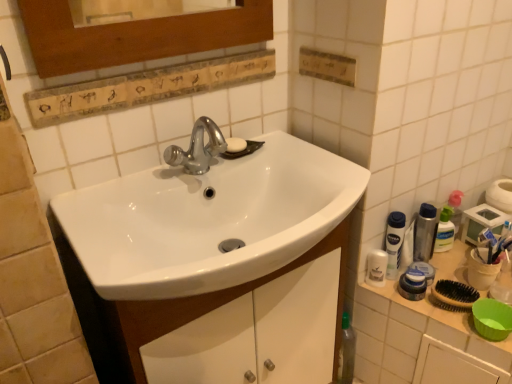
Identify the location of translucent plastic mouthwash at right, acting as the first mouthwash starting from the right. This screenshot has width=512, height=384. (452, 209).

Where is `white glossy sink at center`? This screenshot has height=384, width=512. white glossy sink at center is located at coordinates (165, 309).

What is the approximate width of white matte toothpaste at right?

It is 4.57 centimeters.

The image size is (512, 384). What are the coordinates of `white glossy sink at center` in the screenshot? It's located at pos(208,220).

Measure the distance between white plastic mouthwash at right, the first mouthwash when ordered from left to right, and camera.

white plastic mouthwash at right, the first mouthwash when ordered from left to right, is 1.21 meters away from camera.

This screenshot has width=512, height=384. In order to click on translucent plastic mouthwash at right, acting as the first mouthwash starting from the right in this screenshot , I will do `click(452, 209)`.

From the white matte toothpaste at right, count 4th mouthwashs forward and point to it. Please provide its 2D coordinates.

[(412, 285)]

Between translucent plastic mouthwash at right, the 3th mouthwash in the right-to-left sequence, and white matte toothpaste at right, which one appears on the right side from the viewer's perspective?

white matte toothpaste at right.

Is the position of translucent plastic mouthwash at right, arranged as the 3th mouthwash when viewed from the left, more distant than that of white matte toothpaste at right?

No.

In the scene shown: Is translucent plastic mouthwash at right, arranged as the 3th mouthwash when viewed from the left, bigger or smaller than white matte toothpaste at right?

Considering their sizes, translucent plastic mouthwash at right, arranged as the 3th mouthwash when viewed from the left, takes up more space than white matte toothpaste at right.

From the image's perspective, is white matte toothpaste at right beneath translucent plastic mouthwash at right, the 5th mouthwash viewed from the left?

Correct, white matte toothpaste at right appears lower than translucent plastic mouthwash at right, the 5th mouthwash viewed from the left, in the image.

What's the angular difference between white matte toothpaste at right and translucent plastic mouthwash at right, acting as the first mouthwash starting from the right,'s facing directions?

The facing directions of white matte toothpaste at right and translucent plastic mouthwash at right, acting as the first mouthwash starting from the right, are 0.00169 degrees apart.

Is point (492, 244) positioned before point (455, 198)?

Yes, it is in front of point (455, 198).

In the scene shown: Does white matte toothpaste at right have a lesser width compared to translucent plastic mouthwash at right, acting as the first mouthwash starting from the right?

No.

Measure the distance from white plastic container at right to translucent plastic mouthwash at right, arranged as the 3th mouthwash when viewed from the left.

16.44 centimeters.

Considering the positions of point (464, 281) and point (418, 298), is point (464, 281) closer or farther from the camera than point (418, 298)?

Point (464, 281) appears to be farther away from the viewer than point (418, 298).

From a real-world perspective, which object rests below the other?

From a 3D spatial view, white plastic container at right is below.

Does white plastic container at right have a lesser width compared to translucent plastic mouthwash at right, the 3th mouthwash in the right-to-left sequence?

Incorrect, the width of white plastic container at right is not less than that of translucent plastic mouthwash at right, the 3th mouthwash in the right-to-left sequence.

Between translucent plastic mouthwash at right, the 3th mouthwash in the right-to-left sequence, and white plastic bottle at right, which is the 2th mouthwash from left to right, which one has smaller size?

Smaller between the two is translucent plastic mouthwash at right, the 3th mouthwash in the right-to-left sequence.

Can you see translucent plastic mouthwash at right, arranged as the 3th mouthwash when viewed from the left, touching white plastic bottle at right, which is the 2th mouthwash from left to right?

Yes, the surface of translucent plastic mouthwash at right, arranged as the 3th mouthwash when viewed from the left, is in contact with white plastic bottle at right, which is the 2th mouthwash from left to right.

Find the location of a particular element. The image size is (512, 384). the 2nd mouthwash above the translucent plastic mouthwash at right, the 3th mouthwash in the right-to-left sequence (from the image's perspective) is located at coordinates (394, 242).

From a real-world perspective, is translucent plastic mouthwash at right, the 3th mouthwash in the right-to-left sequence, positioned above or below white plastic bottle at right, which is the 2th mouthwash from left to right?

translucent plastic mouthwash at right, the 3th mouthwash in the right-to-left sequence, is situated lower than white plastic bottle at right, which is the 2th mouthwash from left to right, in the real world.

From a real-world perspective, is white matte toothpaste at right beneath white glossy sink at center?

Incorrect, from a real-world perspective, white matte toothpaste at right is higher than white glossy sink at center.

From the image's perspective, is white matte toothpaste at right positioned above or below white glossy sink at center?

Based on their image positions, white matte toothpaste at right is located above white glossy sink at center.

Considering the positions of objects white matte toothpaste at right and white glossy sink at center in the image provided, who is behind, white matte toothpaste at right or white glossy sink at center?

white matte toothpaste at right is behind.

Could you tell me if white glossy sink at center is facing white matte toothpaste at right?

No, white glossy sink at center is not oriented towards white matte toothpaste at right.

Where is `bathroom cabinet in front of the white matte toothpaste at right`? This screenshot has height=384, width=512. bathroom cabinet in front of the white matte toothpaste at right is located at coordinates (165, 309).

Considering the positions of points (169, 300) and (483, 229), is point (169, 300) closer to camera compared to point (483, 229)?

Yes, point (169, 300) is in front of point (483, 229).

From a real-world perspective, between white glossy sink at center and white glossy sink at center, who is vertically higher?

white glossy sink at center, from a real-world perspective.

What's the angular difference between white glossy sink at center and white glossy sink at center's facing directions?

0.0522 degrees separate the facing orientations of white glossy sink at center and white glossy sink at center.

In the scene shown: Considering the sizes of objects white glossy sink at center and white glossy sink at center in the image provided, who is bigger, white glossy sink at center or white glossy sink at center?

Bigger between the two is white glossy sink at center.

Is white glossy sink at center spatially inside white glossy sink at center, or outside of it?

white glossy sink at center is outside white glossy sink at center.

From a real-world perspective, starting from the white matte toothpaste at right, which mouthwash is the 2nd one below it? Please provide its 2D coordinates.

[(412, 285)]

From a real-world perspective, count 1st mouthwashs upward from the white matte toothpaste at right and point to it. Please provide its 2D coordinates.

[(452, 209)]

Estimate the real-world distances between objects in this image. Which object is closer to white matte toothpaste at right, translucent plastic mouthwash at right, which ranks as the 2th mouthwash in right-to-left order, or white plastic bottle at right, the 4th mouthwash viewed from the right?

translucent plastic mouthwash at right, which ranks as the 2th mouthwash in right-to-left order, lies closer to white matte toothpaste at right than the other object.

From the image, which object appears to be farther from translucent plastic mouthwash at right, which ranks as the 2th mouthwash in right-to-left order, white glossy sink at center or white matte toothpaste at right?

white glossy sink at center.

From the image, which object appears to be nearer to white glossy sink at center, white glossy sink at center or translucent plastic mouthwash at right, acting as the first mouthwash starting from the right?

white glossy sink at center.

Considering their positions, is white plastic bottle at right, the 4th mouthwash viewed from the right, positioned further to translucent plastic mouthwash at right, arranged as the 3th mouthwash when viewed from the left, than translucent plastic mouthwash at right, acting as the first mouthwash starting from the right?

translucent plastic mouthwash at right, acting as the first mouthwash starting from the right, lies further to translucent plastic mouthwash at right, arranged as the 3th mouthwash when viewed from the left, than the other object.

When comparing their distances from translucent plastic mouthwash at right, the 5th mouthwash viewed from the left, does white plastic container at right or white glossy sink at center seem further?

white glossy sink at center is positioned further to the anchor translucent plastic mouthwash at right, the 5th mouthwash viewed from the left.

Which object lies nearer to the anchor point white glossy sink at center, white plastic container at right or translucent plastic mouthwash at right, the 5th mouthwash viewed from the left?

Based on the image, white plastic container at right appears to be nearer to white glossy sink at center.

Based on their spatial positions, is white glossy sink at center or translucent plastic mouthwash at right, the 3th mouthwash in the right-to-left sequence, further from white glossy sink at center?

Based on the image, translucent plastic mouthwash at right, the 3th mouthwash in the right-to-left sequence, appears to be further to white glossy sink at center.

Estimate the real-world distances between objects in this image. Which object is closer to white matte toothpaste at right, white plastic container at right or translucent plastic mouthwash at right, the 3th mouthwash in the right-to-left sequence?

The object closer to white matte toothpaste at right is translucent plastic mouthwash at right, the 3th mouthwash in the right-to-left sequence.

Locate an element on the screen. The width and height of the screenshot is (512, 384). sink situated between white glossy sink at center and white matte toothpaste at right from left to right is located at coordinates click(208, 220).

Where is `bathroom cabinet between white glossy sink at center and white plastic bottle at right, the 4th mouthwash viewed from the right, from front to back`? bathroom cabinet between white glossy sink at center and white plastic bottle at right, the 4th mouthwash viewed from the right, from front to back is located at coordinates (165, 309).

Image resolution: width=512 pixels, height=384 pixels. Find the location of `mouthwash between translucent plastic mouthwash at right, arranged as the 3th mouthwash when viewed from the left, and translucent plastic mouthwash at right, the 5th mouthwash viewed from the left, in the horizontal direction`. mouthwash between translucent plastic mouthwash at right, arranged as the 3th mouthwash when viewed from the left, and translucent plastic mouthwash at right, the 5th mouthwash viewed from the left, in the horizontal direction is located at coordinates (425, 233).

The image size is (512, 384). I want to click on mouthwash located between white glossy sink at center and white plastic bottle at right, the 4th mouthwash viewed from the right, in the left-right direction, so click(376, 268).